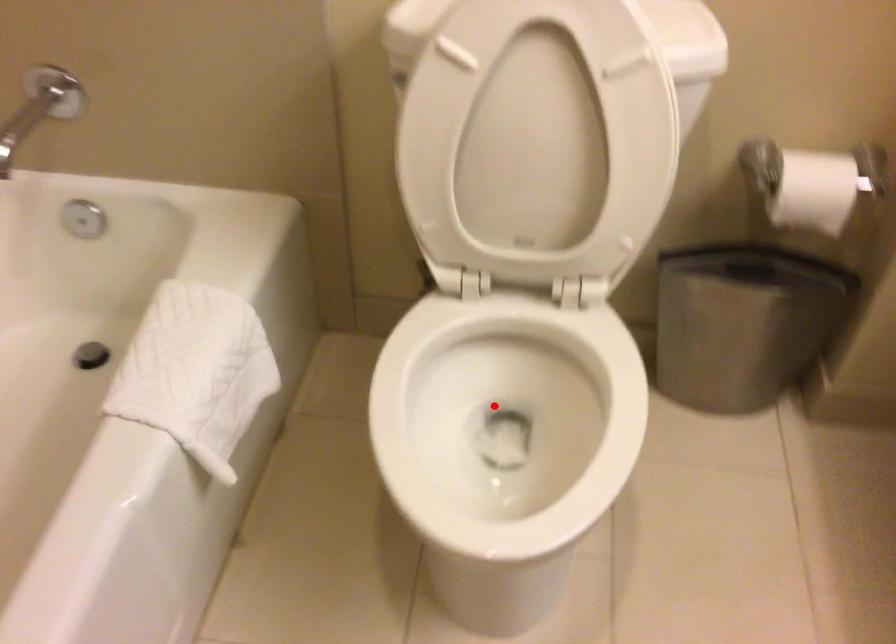
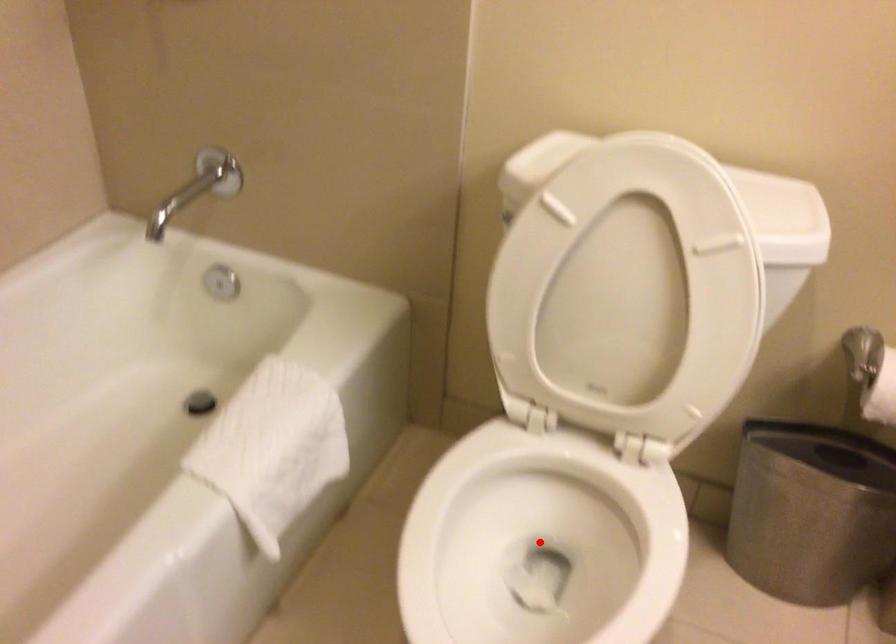
I am providing you with two images of the same scene from different viewpoints. A red point is marked on the first image and another point is marked on the second image. Are the points marked in image1 and image2 representing the same 3D position?

Yes